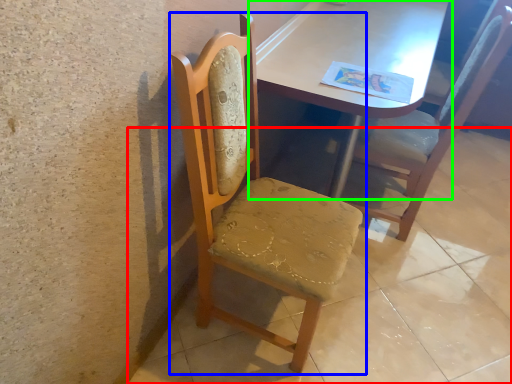
Question: Which object is positioned closest to concrete (highlighted by a red box)? Select from chair (highlighted by a blue box) and table (highlighted by a green box).

Choices:
 (A) chair
 (B) table

Answer: (A)